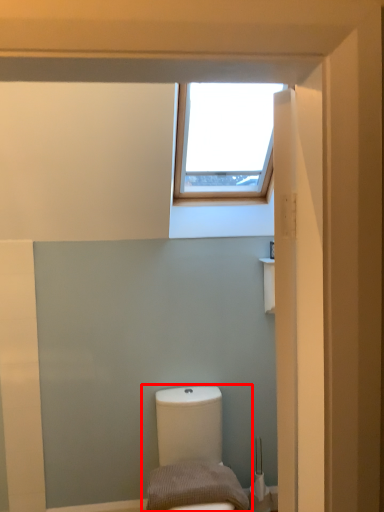
Question: From the image's perspective, what is the correct spatial relationship of toilet (annotated by the red box) in relation to pillow?

Choices:
 (A) below
 (B) above

Answer: (A)